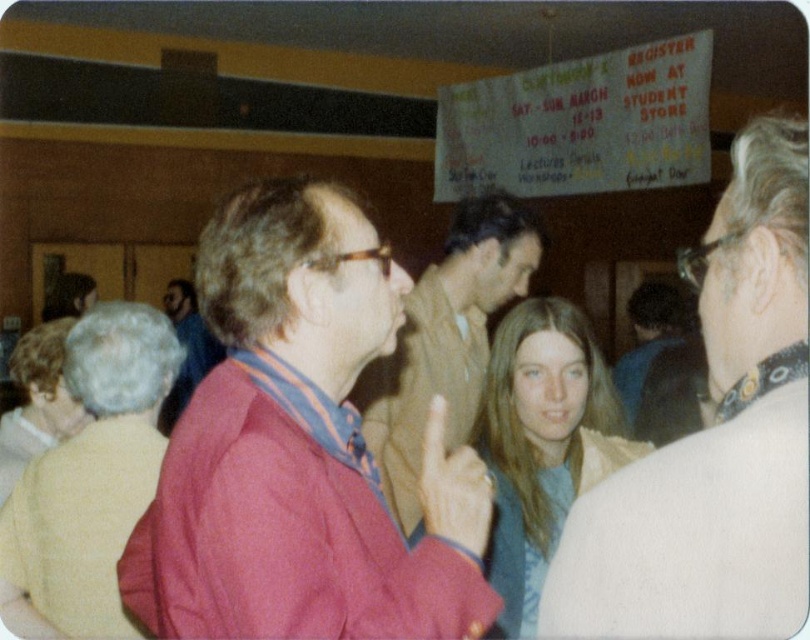
Who is positioned more to the right, matte red shirt at center or dark blue shirt at center?

Positioned to the right is dark blue shirt at center.

Does point (437, 392) come behind point (627, 372)?

No, it is not.

You are a GUI agent. You are given a task and a screenshot of the screen. Output one action in this format:
    pyautogui.click(x=<x>, y=<y>)
    Task: Click on the matte red shirt at center
    This screenshot has width=810, height=640.
    Given the screenshot: What is the action you would take?
    pyautogui.click(x=446, y=340)

Can you confirm if matte red jacket at center is positioned to the left of light yellow sweater at lower left?

Incorrect, matte red jacket at center is not on the left side of light yellow sweater at lower left.

In the scene shown: Is matte red jacket at center shorter than light yellow sweater at lower left?

Indeed, matte red jacket at center has a lesser height compared to light yellow sweater at lower left.

What do you see at coordinates (301, 451) in the screenshot?
I see `matte red jacket at center` at bounding box center [301, 451].

Where is `matte red jacket at center`? The width and height of the screenshot is (810, 640). matte red jacket at center is located at coordinates (301, 451).

Does blonde hair at center have a greater height compared to dark blue shirt at center?

Incorrect, blonde hair at center's height is not larger of dark blue shirt at center's.

Who is positioned more to the right, blonde hair at center or dark blue shirt at center?

dark blue shirt at center

Is point (578, 346) positioned before point (653, 403)?

That is True.

The height and width of the screenshot is (640, 810). What are the coordinates of `blonde hair at center` in the screenshot? It's located at pos(540,444).